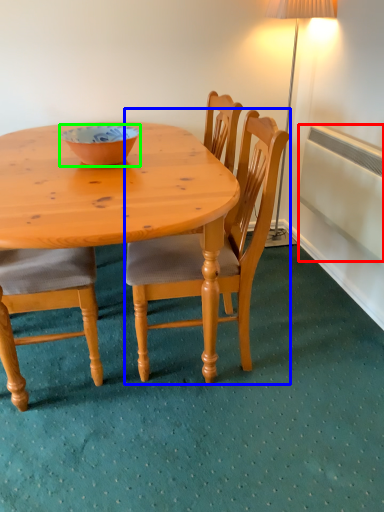
Question: Considering the real-world distances, which object is farthest from radiator (highlighted by a red box)? chair (highlighted by a blue box) or bowl (highlighted by a green box)?

Choices:
 (A) chair
 (B) bowl

Answer: (B)